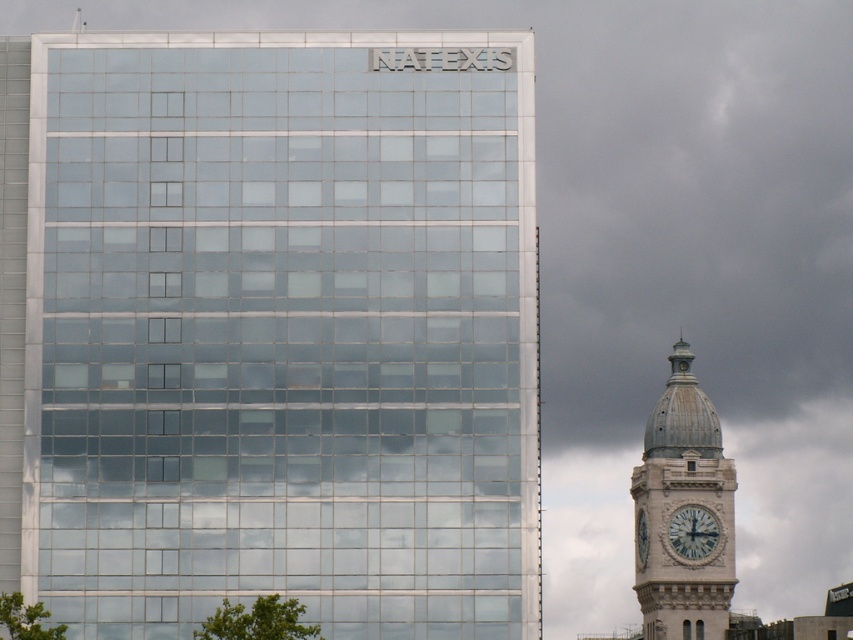
Measure the distance between transparent glass building at upper left and camera.

105.19 meters

Who is taller, transparent glass building at upper left or light gray stone clock tower at right?

Standing taller between the two is transparent glass building at upper left.

The image size is (853, 640). Describe the element at coordinates (270, 330) in the screenshot. I see `transparent glass building at upper left` at that location.

The image size is (853, 640). Identify the location of transparent glass building at upper left. (270, 330).

Does transparent glass building at upper left have a smaller size compared to white stone clock at right?

Actually, transparent glass building at upper left might be larger than white stone clock at right.

Who is more forward, (349, 358) or (701, 541)?

Positioned in front is point (349, 358).

Does point (440, 628) lie behind point (711, 552)?

No, it is in front of (711, 552).

Find the location of `transparent glass building at upper left`. transparent glass building at upper left is located at coordinates (270, 330).

Between point (643, 506) and point (693, 513), which one is positioned in front?

Point (693, 513) is in front.

Is point (683, 493) closer to viewer compared to point (677, 515)?

No, (683, 493) is further to viewer.

Is point (670, 515) positioned in front of point (705, 545)?

That is True.

Identify the location of light gray stone clock tower at right. (683, 513).